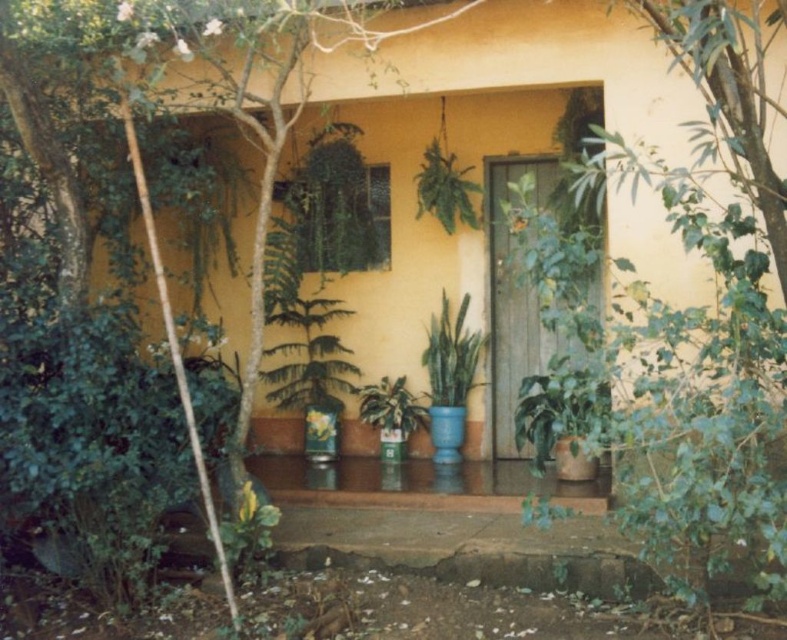
Which is in front, point (660, 12) or point (420, 205)?

Point (660, 12)

Can you confirm if green leafy tree at center is positioned to the left of green leafy plant at center?

In fact, green leafy tree at center is to the right of green leafy plant at center.

Which is behind, point (593, 154) or point (457, 216)?

The point (457, 216) is more distant.

Find the location of `green leafy tree at center`. green leafy tree at center is located at coordinates (680, 323).